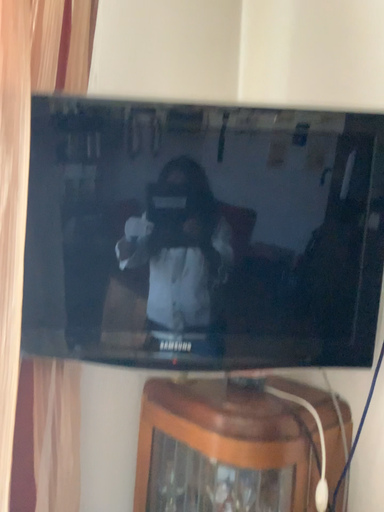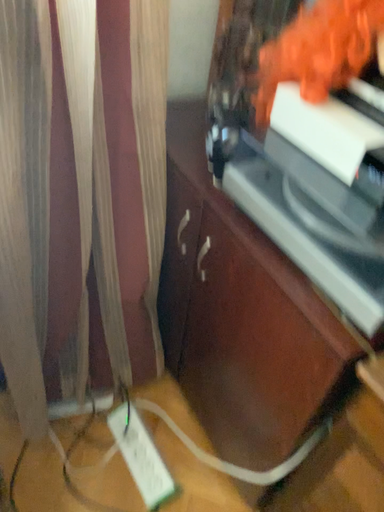
Question: Which way did the camera rotate in the video?

Choices:
 (A) rotated left
 (B) rotated right

Answer: (A)